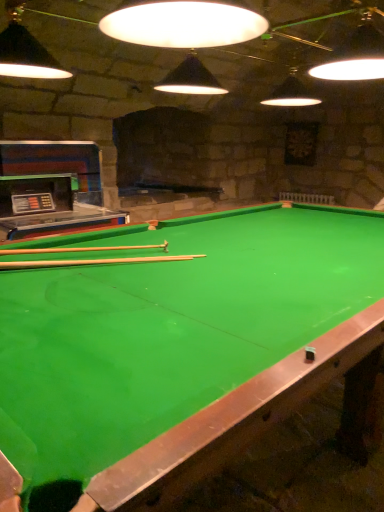
Question: In terms of size, does wooden cue at center, arranged as the 1th cue when ordered from the bottom, appear bigger or smaller than wooden cue at center, which is the first cue from top to bottom?

Choices:
 (A) big
 (B) small

Answer: (B)

Question: Visually, is wooden cue at center, arranged as the 1th cue when ordered from the bottom, positioned to the left or to the right of wooden cue at center, which is the first cue from top to bottom?

Choices:
 (A) right
 (B) left

Answer: (A)

Question: Which object is positioned farthest from the green felt billiard table at center?

Choices:
 (A) wooden cue at center, which is the second cue in top-to-bottom order
 (B) wooden cue at center, which is the first cue from top to bottom

Answer: (B)

Question: Estimate the real-world distances between objects in this image. Which object is farther from the wooden cue at center, positioned as the second cue in bottom-to-top order?

Choices:
 (A) green felt billiard table at center
 (B) wooden cue at center, which is the second cue in top-to-bottom order

Answer: (A)